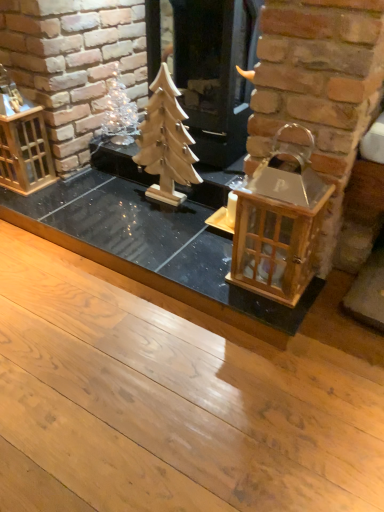
Where is `vacant space in wooden christmas tree at center (from a real-world perspective)`? vacant space in wooden christmas tree at center (from a real-world perspective) is located at coordinates (168, 203).